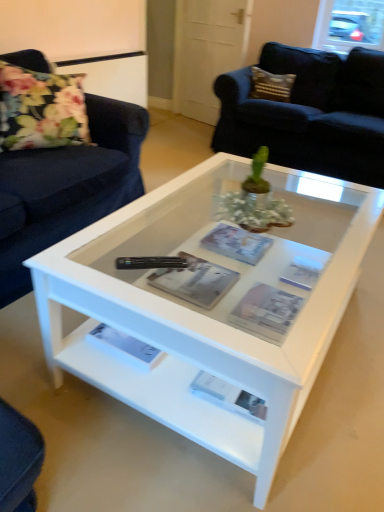
Where is `vacant area on top of matte gray magazine at center, marked as the first magazine in a front-to-back arrangement (from a real-world perspective)`? vacant area on top of matte gray magazine at center, marked as the first magazine in a front-to-back arrangement (from a real-world perspective) is located at coordinates (271, 309).